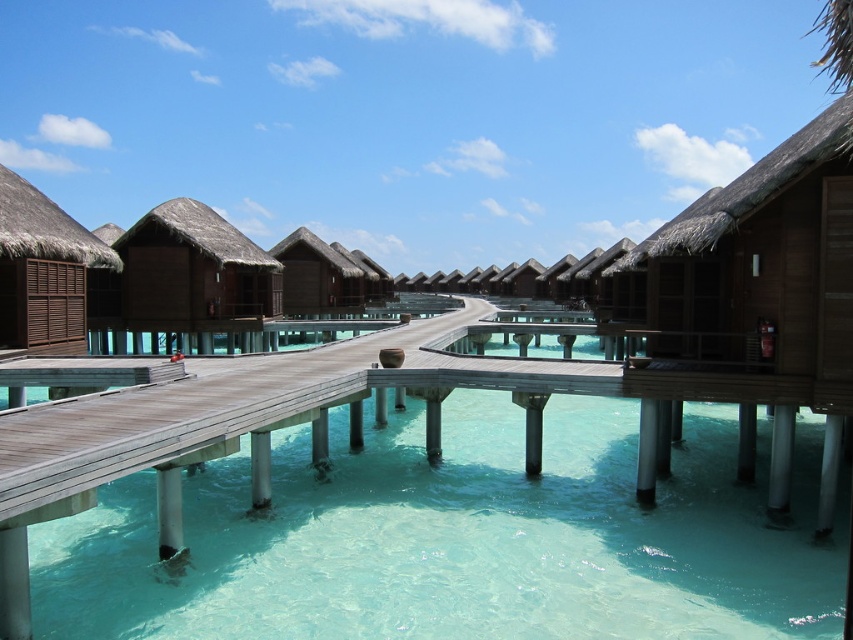
Question: Can you confirm if clear turquoise water at center is smaller than brown thatched roof hut at center?

Choices:
 (A) no
 (B) yes

Answer: (B)

Question: Considering the real-world distances, which object is farthest from the brown thatched roof hut at center?

Choices:
 (A) brown wooden hut at left
 (B) clear turquoise water at center

Answer: (B)

Question: Considering the real-world distances, which object is closest to the brown thatched roof hut at center?

Choices:
 (A) matte brown hut at center
 (B) clear turquoise water at center

Answer: (A)

Question: Is clear turquoise water at center above brown wooden hut at left?

Choices:
 (A) no
 (B) yes

Answer: (A)

Question: Can you confirm if clear turquoise water at center is bigger than matte brown hut at center?

Choices:
 (A) yes
 (B) no

Answer: (A)

Question: Among these points, which one is farthest from the camera?

Choices:
 (A) (91, 262)
 (B) (360, 566)
 (C) (173, 316)

Answer: (C)